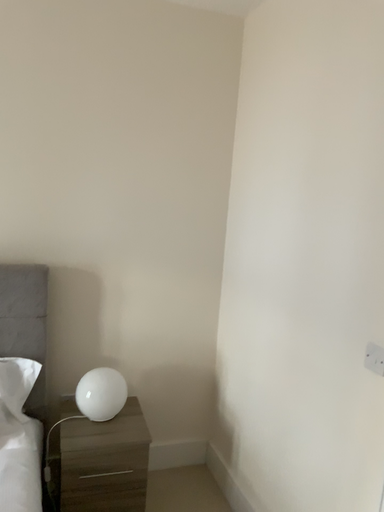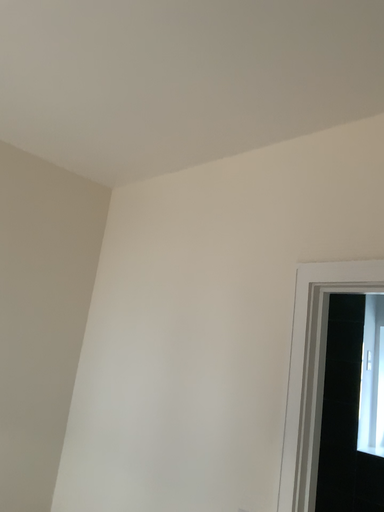
Question: How did the camera likely rotate when shooting the video?

Choices:
 (A) rotated left
 (B) rotated right

Answer: (B)